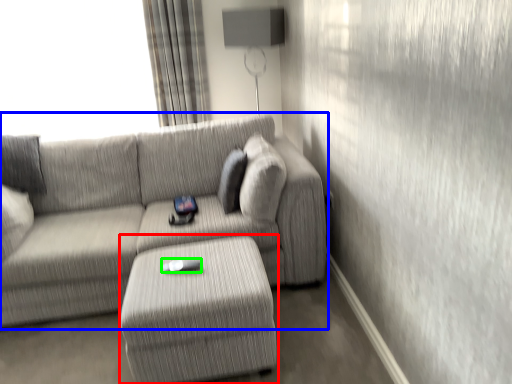
Question: Which is farther away from table (highlighted by a red box)? studio couch (highlighted by a blue box) or Wii controller (highlighted by a green box)?

Choices:
 (A) studio couch
 (B) Wii controller

Answer: (A)